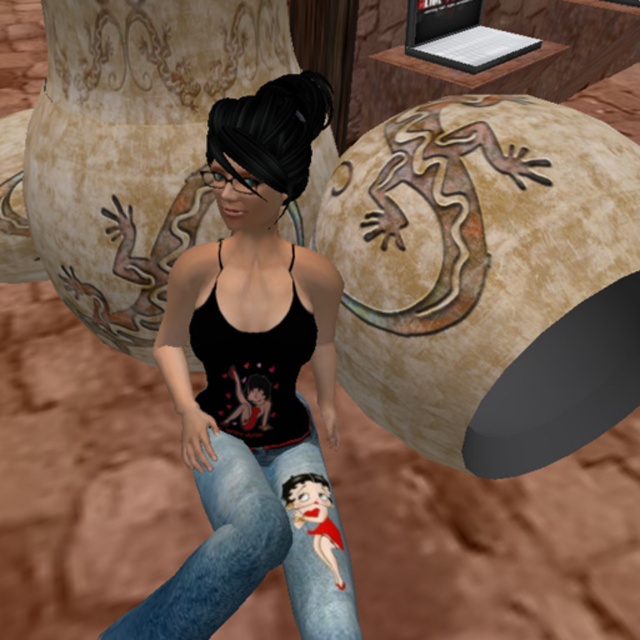
Between black matte tank top at center and denim jeans at center, which one is positioned lower?

denim jeans at center is lower down.

Is point (266, 324) closer to camera compared to point (257, 481)?

That is False.

What do you see at coordinates (253, 384) in the screenshot? I see `black matte tank top at center` at bounding box center [253, 384].

Locate an element on the screen. This screenshot has height=640, width=640. black matte tank top at center is located at coordinates (253, 384).